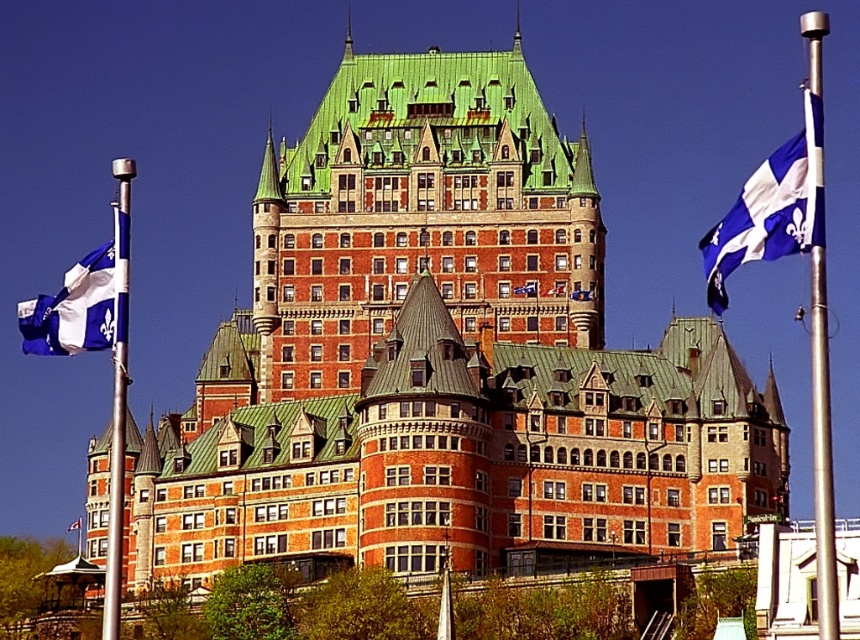
Question: Considering the relative positions of silver metallic pole at right and blue and white fabric flag at left in the image provided, where is silver metallic pole at right located with respect to blue and white fabric flag at left?

Choices:
 (A) below
 (B) above

Answer: (A)

Question: Can you confirm if metallic silver flag pole at left is bigger than blue fabric flag at upper left?

Choices:
 (A) no
 (B) yes

Answer: (B)

Question: Which point is closer to the camera?

Choices:
 (A) silver metallic pole at right
 (B) blue fabric flag at upper left

Answer: (A)

Question: In this image, where is green shingled roof at center located relative to blue fabric flag at upper left?

Choices:
 (A) left
 (B) right

Answer: (B)

Question: Among these points, which one is nearest to the camera?

Choices:
 (A) (785, 202)
 (B) (560, 220)
 (C) (822, 616)
 (D) (102, 304)

Answer: (A)

Question: Which of the following is the closest to the observer?

Choices:
 (A) (748, 212)
 (B) (66, 525)
 (C) (114, 160)
 (D) (41, 326)

Answer: (A)